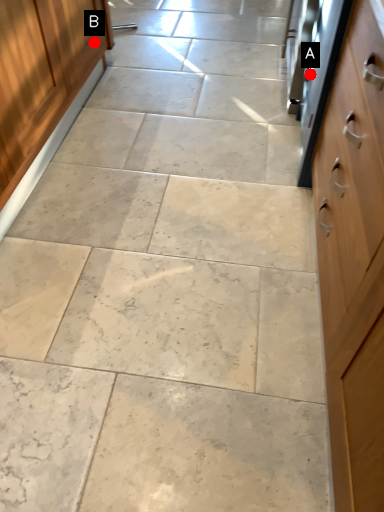
Question: Two points are circled on the image, labeled by A and B beside each circle. Which point is farther from the camera taking this photo?

Choices:
 (A) A is further
 (B) B is further

Answer: (B)